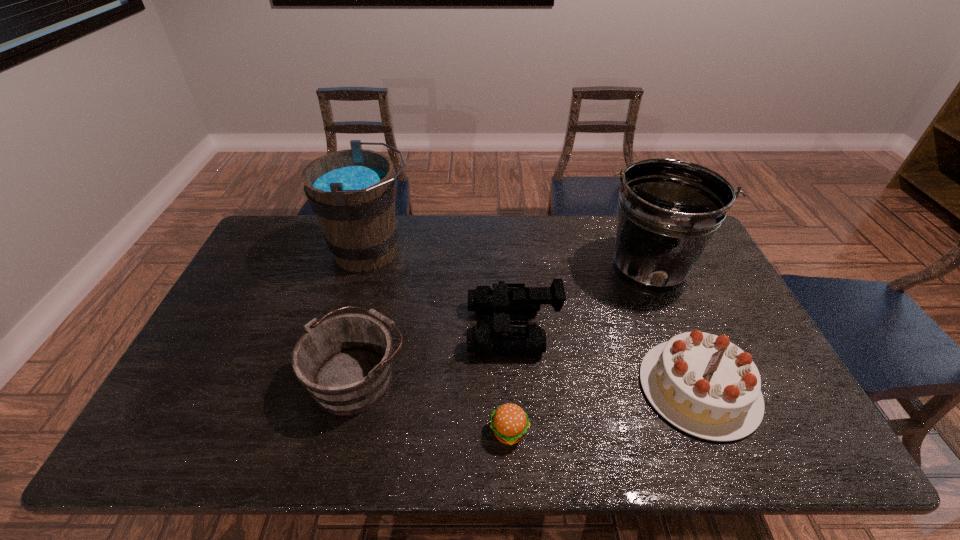
Locate an element on the screen. This screenshot has width=960, height=540. birthday cake that is at the right edge is located at coordinates (703, 384).

Find the location of a particular element. The width and height of the screenshot is (960, 540). object that is positioned at the far right corner is located at coordinates (669, 209).

At what (x,y) coordinates should I click in order to perform the action: click on object that is at the near right corner. Please return your answer as a coordinate pair (x, y). The width and height of the screenshot is (960, 540). Looking at the image, I should click on (703, 384).

Where is `free point at the far edge`? The width and height of the screenshot is (960, 540). free point at the far edge is located at coordinates (565, 226).

In the image, there is a desktop. What are the coordinates of `free space at the near edge` in the screenshot? It's located at (240, 442).

Locate an element on the screen. The image size is (960, 540). blank space at the left edge is located at coordinates (292, 274).

Locate an element on the screen. free space at the right edge of the desktop is located at coordinates (804, 417).

I want to click on free space at the near left corner of the desktop, so click(194, 437).

Find the location of a particular element. The height and width of the screenshot is (540, 960). vacant region at the far right corner is located at coordinates (704, 252).

Image resolution: width=960 pixels, height=540 pixels. What are the coordinates of `vacant space that is in between the shortest object and the binoculars` in the screenshot? It's located at (511, 380).